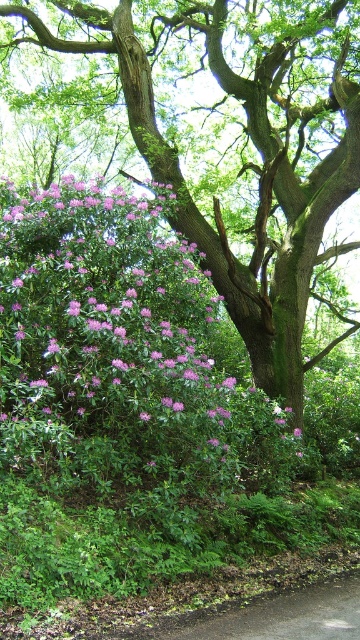
Question: Which point is farther to the camera?

Choices:
 (A) (300, 429)
 (B) (114, 49)

Answer: (B)

Question: Which point is farther to the camera?

Choices:
 (A) pink matte flower at center
 (B) green rough bark tree at upper center

Answer: (B)

Question: Observing the image, what is the correct spatial positioning of green rough bark tree at upper center in reference to pink matte flower at center?

Choices:
 (A) above
 (B) below

Answer: (A)

Question: Can you confirm if green rough bark tree at upper center is bigger than pink matte flower at center?

Choices:
 (A) no
 (B) yes

Answer: (B)

Question: Can you confirm if green rough bark tree at upper center is bigger than pink matte flower at center?

Choices:
 (A) no
 (B) yes

Answer: (B)

Question: Which point is closer to the camera?

Choices:
 (A) (298, 429)
 (B) (181, 177)

Answer: (A)